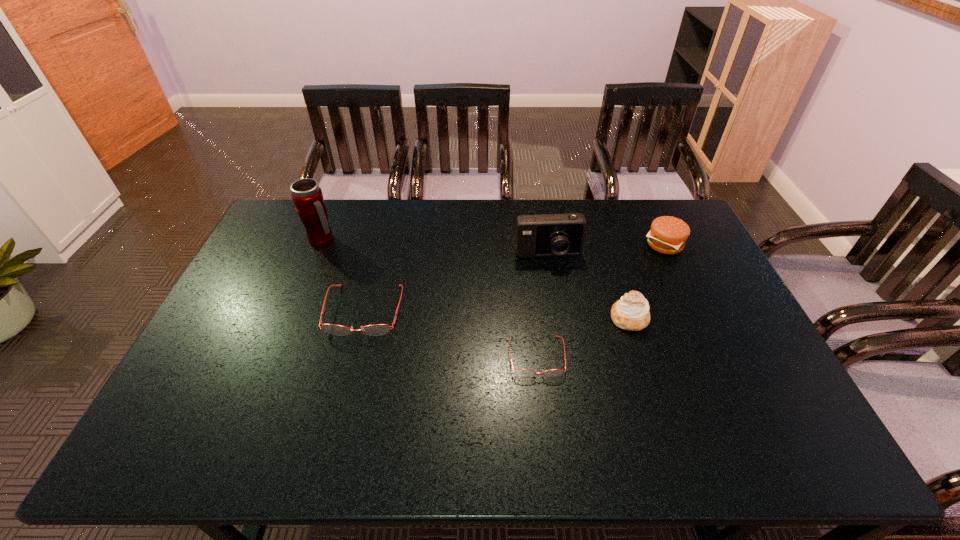
You are a GUI agent. You are given a task and a screenshot of the screen. Output one action in this format:
    pyautogui.click(x=<x>, y=<y>)
    Task: Click on the object located in the far right corner section of the desktop
    This screenshot has height=540, width=960.
    Given the screenshot: What is the action you would take?
    pyautogui.click(x=668, y=235)

The width and height of the screenshot is (960, 540). I want to click on vacant region at the far edge of the desktop, so click(x=332, y=212).

This screenshot has height=540, width=960. Identify the location of vacant space at the near edge of the desktop. (322, 393).

Locate an element on the screen. vacant space at the left edge of the desktop is located at coordinates (291, 242).

Where is `vacant space at the right edge of the desktop`? The height and width of the screenshot is (540, 960). vacant space at the right edge of the desktop is located at coordinates (732, 305).

At what (x,y) coordinates should I click in order to perform the action: click on vacant space at the far left corner. Please return your answer as a coordinate pair (x, y). The image size is (960, 540). Looking at the image, I should click on (300, 237).

Find the location of a particular element. This screenshot has width=960, height=540. free space between the pastry and the taller spectacles is located at coordinates (496, 314).

Locate an element on the screen. free space that is in between the rightmost object and the right spectacles is located at coordinates (601, 300).

I want to click on free spot between the fifth object from left to right and the fifth shortest object, so click(x=588, y=287).

In order to click on vacant space that's between the hamburger and the pastry in this screenshot , I will do `click(647, 281)`.